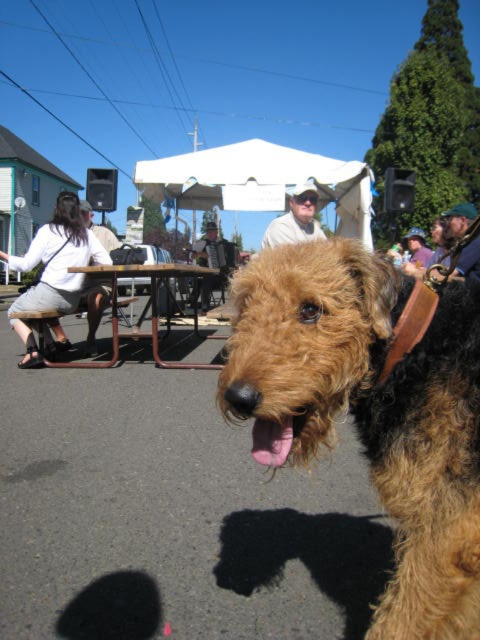
Question: Does white cotton shirt at left appear under brown metal table at center?

Choices:
 (A) no
 (B) yes

Answer: (B)

Question: Which is farther from the white shirt at upper left?

Choices:
 (A) matte purple shirt at center
 (B) white fabric tent at upper center
 (C) brown metal table at center

Answer: (A)

Question: Is brown furry dog at center positioned behind brown metal table at center?

Choices:
 (A) yes
 (B) no

Answer: (B)

Question: Can you confirm if brown metal table at center is bigger than light brown leather jacket at center?

Choices:
 (A) no
 (B) yes

Answer: (A)

Question: Which point is closer to the camera?

Choices:
 (A) (31, 268)
 (B) (417, 237)
 (C) (108, 246)

Answer: (A)

Question: Which point is closer to the camera taking this photo?

Choices:
 (A) (379, 602)
 (B) (289, 209)

Answer: (A)